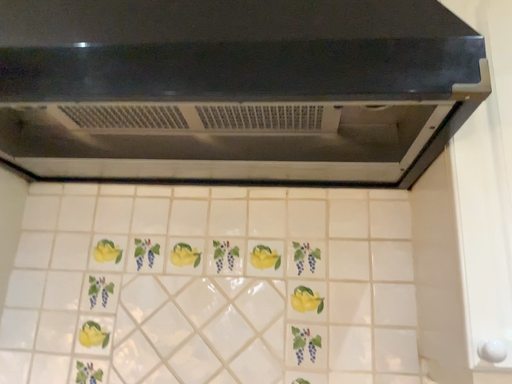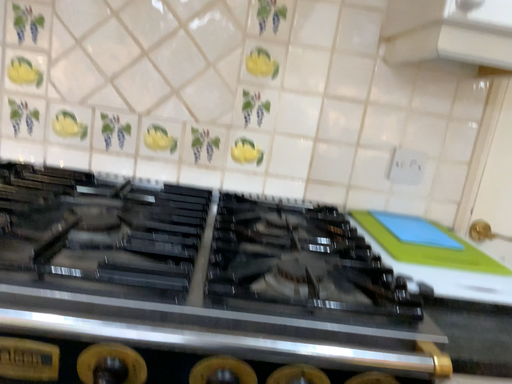
Question: How did the camera likely rotate when shooting the video?

Choices:
 (A) rotated downward
 (B) rotated upward

Answer: (A)